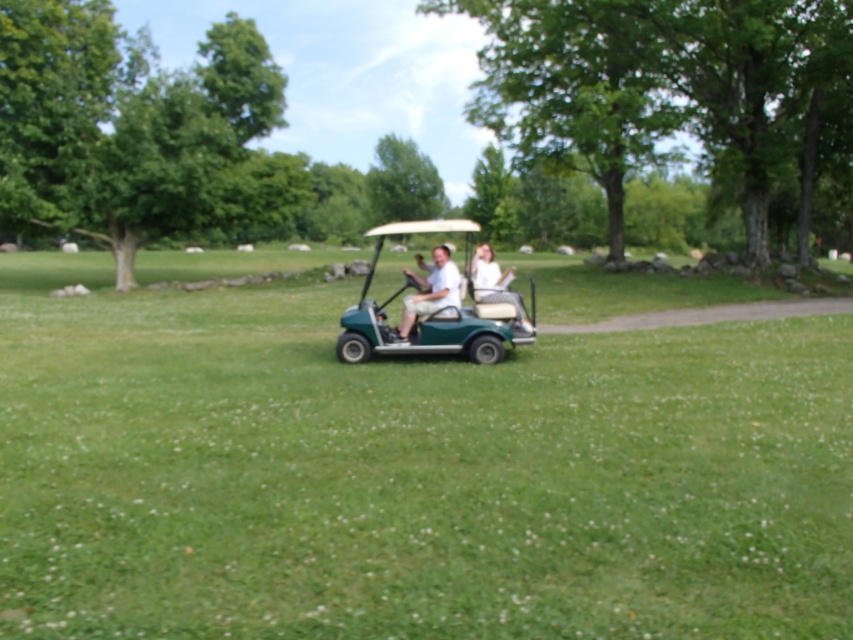
Question: Which point is farther to the camera?

Choices:
 (A) matte green golf cart at center
 (B) green matte golf cart at center

Answer: (A)

Question: Which object is closer to the camera taking this photo?

Choices:
 (A) green matte golf cart at center
 (B) green plastic golf cart at center
 (C) white fabric shirt at center

Answer: (B)

Question: Which object is closer to the camera taking this photo?

Choices:
 (A) white matte golf cart at center
 (B) white fabric shirt at center
 (C) matte green golf cart at center

Answer: (B)

Question: Is white matte golf cart at center closer to camera compared to matte green golf cart at center?

Choices:
 (A) yes
 (B) no

Answer: (B)

Question: Considering the relative positions of green plastic golf cart at center and white fabric shirt at center in the image provided, where is green plastic golf cart at center located with respect to white fabric shirt at center?

Choices:
 (A) right
 (B) left

Answer: (B)

Question: Is white matte golf cart at center behind white fabric shirt at center?

Choices:
 (A) no
 (B) yes

Answer: (B)